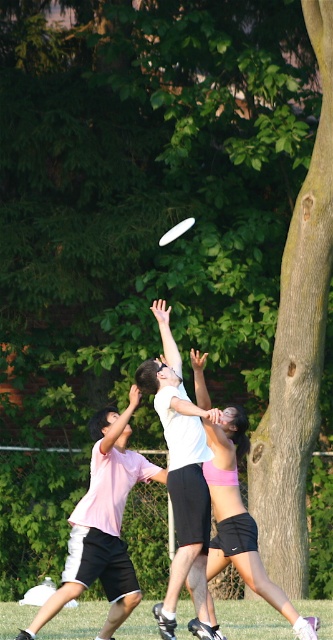
You are an ultimate frisbee player trying to determine the best position to catch the frisbee. Based on the image, which object, the white matte shirt at center or the pink fabric shorts at center, is narrower and might allow you to position yourself closer to the frisbee without obstruction?

The white matte shirt at center has a lesser width compared to the pink fabric shorts at center, so positioning yourself closer to the white matte shirt at center would allow you to get nearer to the frisbee with less obstruction.

In the ultimate frisbee game scene, there is a point marked at coordinates (102, 524). Which object from the scene does this point lie on?

The point at coordinates (102, 524) is located on the pink matte shirt at center.

You are a referee at an ultimate frisbee game and need to determine if the two players at the center are within the required 60 cm distance for a legal play. The players are wearing the white matte shirt at center and the pink fabric shorts at center. Are they within the legal distance?

The white matte shirt at center is 61.08 centimeters from the pink fabric shorts at center. Since 61.08 cm exceeds the 60 cm requirement, the players are not within the legal distance for a legal play.